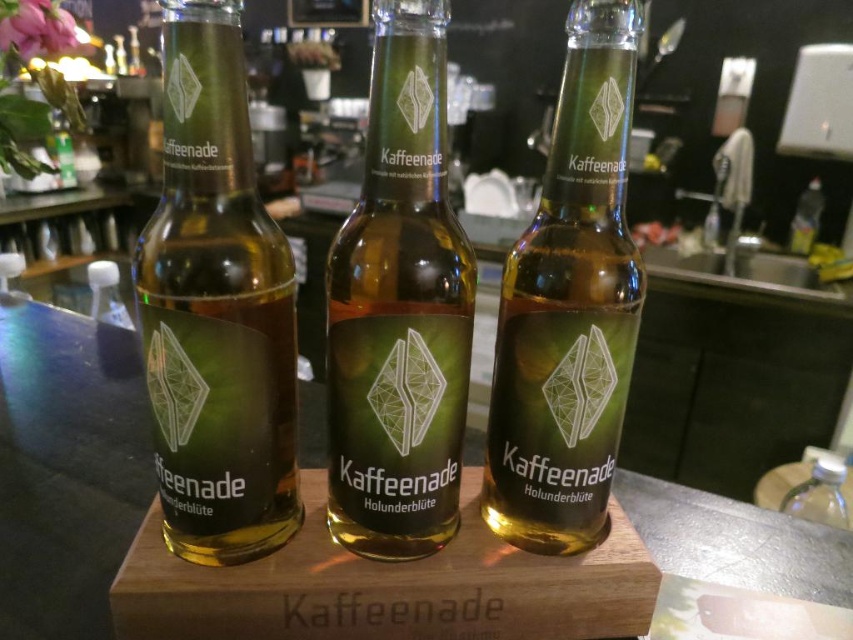
Question: Does green glass bottle at center appear over transparent plastic bottle at lower right?

Choices:
 (A) no
 (B) yes

Answer: (B)

Question: Is green matte glass bottle at center closer to the viewer compared to green glass bottle at center?

Choices:
 (A) no
 (B) yes

Answer: (B)

Question: Among these objects, which one is nearest to the camera?

Choices:
 (A) green glass bottle at center
 (B) green glass bottle at left
 (C) green matte glass bottle at center
 (D) transparent plastic bottle at lower right

Answer: (B)

Question: Which object is the farthest from the transparent plastic bottle at lower right?

Choices:
 (A) green matte glass bottle at center
 (B) green glass bottle at left

Answer: (B)

Question: Which object is positioned farthest from the green glass bottle at left?

Choices:
 (A) transparent plastic bottle at lower right
 (B) green matte glass bottle at center

Answer: (A)

Question: Does green glass bottle at left have a smaller size compared to transparent plastic bottle at lower right?

Choices:
 (A) no
 (B) yes

Answer: (A)